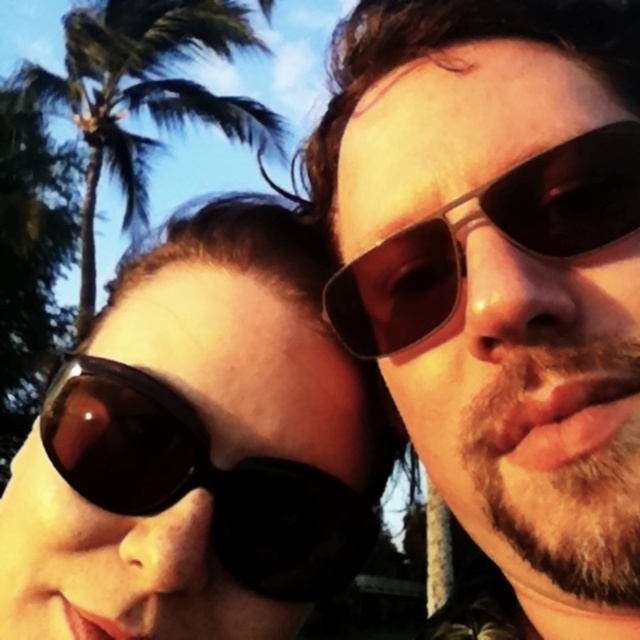
You are trying to decide between the matte black sunglasses at left and the matte black goggles at left for a casual outdoor event. Based on their sizes, which one might be more comfortable for a longer period?

The matte black sunglasses at left are larger than the matte black goggles at left, so they might be more comfortable for a longer period due to their size.

From the picture: You are taking a photo of two people standing side by side. You notice both have matte black sunglasses at left and matte black goggles at left. Which one is positioned more to the right between the two?

The matte black sunglasses at left is positioned more to the right than the matte black goggles at left.

You are a photographer trying to capture a clear photo of both the matte black sunglasses at left and the matte black goggles at left. Since they are both dark and similar in color, you need to adjust your camera settings to ensure proper focus. Which object should you focus on first to ensure both are in focus?

You should focus on the matte black sunglasses at left first because it is in front of the matte black goggles at left, so focusing on the closer object will help ensure both are in focus.